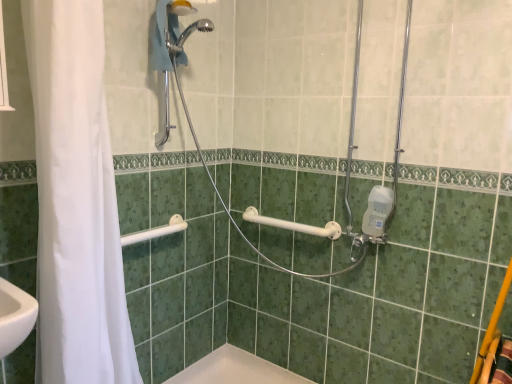
Question: Is metallic silver shower at center, the 2th shower positioned from the bottom, wider or thinner than white plastic grab bar at upper left, the 1th shower in the bottom-to-top sequence?

Choices:
 (A) thin
 (B) wide

Answer: (B)

Question: Would you say metallic silver shower at center, positioned as the second shower in top-to-bottom order, is inside or outside white plastic grab bar at upper left, which is the third shower from top to bottom?

Choices:
 (A) outside
 (B) inside

Answer: (A)

Question: Estimate the real-world distances between objects in this image. Which object is closer to the chrome metallic shower head at upper center, positioned as the 1th shower in top-to-bottom order?

Choices:
 (A) white fabric shower curtain at left
 (B) white plastic towel bar at center
 (C) white plastic grab bar at upper left, which is the third shower from top to bottom
 (D) metallic silver shower at center, positioned as the second shower in top-to-bottom order

Answer: (A)

Question: Which is nearer to the metallic silver shower at center, positioned as the second shower in top-to-bottom order?

Choices:
 (A) white fabric shower curtain at left
 (B) white plastic towel bar at center
 (C) chrome metallic shower head at upper center, the third shower positioned from the bottom
 (D) white plastic grab bar at upper left, the 1th shower in the bottom-to-top sequence

Answer: (B)